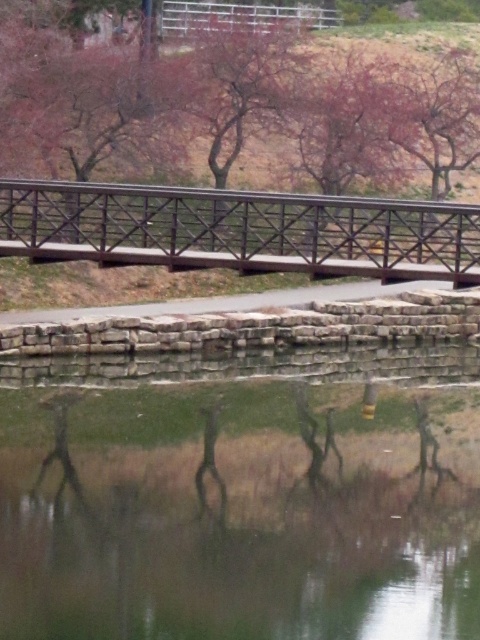
Looking at this image, you are standing at the viewpoint of the image and want to reach the point marked as point (153, 461). If your walking speed is 1.2 meters per second, how many seconds will it take you to reach that point?

The point (153, 461) is 25.00 meters away from the viewer. At a walking speed of 1.2 meters per second, it will take approximately 20.83 seconds to reach it. Since the question asks for seconds, rounding to two decimal places gives 20.83 seconds.

You are standing on the black metal bridge at center and looking down. Can you see the transparent water at lower center below you?

Yes, because the transparent water at lower center is positioned under the black metal bridge at center, so you can see it below you.

In the scene shown: You are standing on the metal bridge and looking towards the smooth pink tree at center and the transparent water at lower center. Which object is higher in elevation?

The smooth pink tree at center is much taller than transparent water at lower center, so the smooth pink tree at center is higher in elevation.